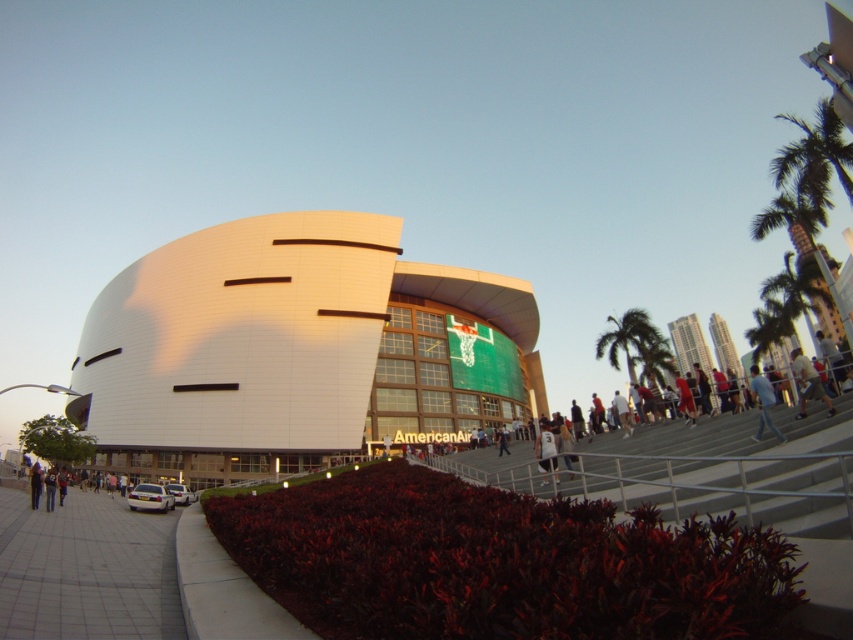
Consider the image. Is green leafy palm tree at right shorter than blue jeans at lower right?

No, green leafy palm tree at right is not shorter than blue jeans at lower right.

Can you confirm if green leafy palm tree at right is positioned to the left of blue jeans at lower right?

No, green leafy palm tree at right is not to the left of blue jeans at lower right.

What do you see at coordinates (634, 344) in the screenshot? I see `green leafy palm tree at right` at bounding box center [634, 344].

Where is `green leafy palm tree at right`? green leafy palm tree at right is located at coordinates (634, 344).

Does point (804, 365) lie behind point (753, 390)?

No, it is not.

Is light blue jeans at right bigger than blue jeans at lower right?

Correct, light blue jeans at right is larger in size than blue jeans at lower right.

Which is in front, point (804, 390) or point (758, 378)?

Point (804, 390) is more forward.

The width and height of the screenshot is (853, 640). Identify the location of light blue jeans at right. [x=807, y=384].

Does gray tile pavement at lower left lie behind green leafy palm tree at right?

No, gray tile pavement at lower left is in front of green leafy palm tree at right.

Is point (90, 595) farther from camera compared to point (634, 339)?

That is False.

The image size is (853, 640). What do you see at coordinates (86, 570) in the screenshot?
I see `gray tile pavement at lower left` at bounding box center [86, 570].

Locate an element on the screen. Image resolution: width=853 pixels, height=640 pixels. gray tile pavement at lower left is located at coordinates (86, 570).